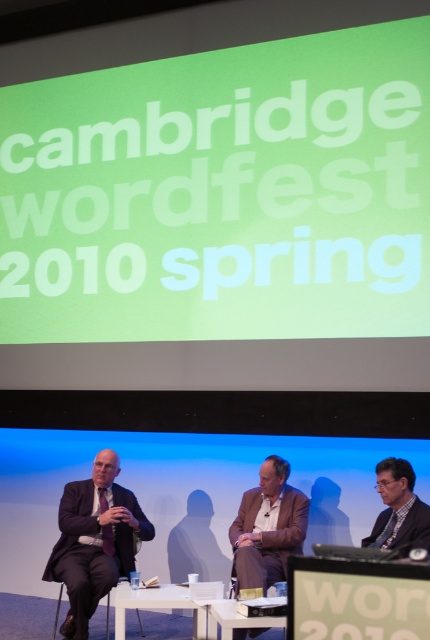
Between point (178, 596) and point (224, 608), which one is positioned in front?

Point (224, 608)

Between white plastic table at center and white glossy table at lower center, which one is positioned higher?

white plastic table at center

Is point (134, 593) positioned behind point (209, 624)?

No, (134, 593) is in front of (209, 624).

You are a GUI agent. You are given a task and a screenshot of the screen. Output one action in this format:
    pyautogui.click(x=<x>, y=<y>)
    Task: Click on the white plastic table at center
    The height and width of the screenshot is (640, 430).
    Given the screenshot: What is the action you would take?
    pyautogui.click(x=156, y=604)

Who is positioned more to the right, brown leather jacket at center or dark gray suit at lower right?

dark gray suit at lower right

Is point (300, 545) positioned in front of point (389, 461)?

No, (300, 545) is behind (389, 461).

What do you see at coordinates (267, 528) in the screenshot? I see `brown leather jacket at center` at bounding box center [267, 528].

Where is `brown leather jacket at center`? The width and height of the screenshot is (430, 640). brown leather jacket at center is located at coordinates (267, 528).

Is brown leather jacket at center bigger than white plastic table at center?

Yes.

Is brown leather jacket at center taller than white plastic table at center?

Yes, brown leather jacket at center is taller than white plastic table at center.

At what (x,y) coordinates should I click in order to perform the action: click on brown leather jacket at center. Please return your answer as a coordinate pair (x, y). Looking at the image, I should click on (267, 528).